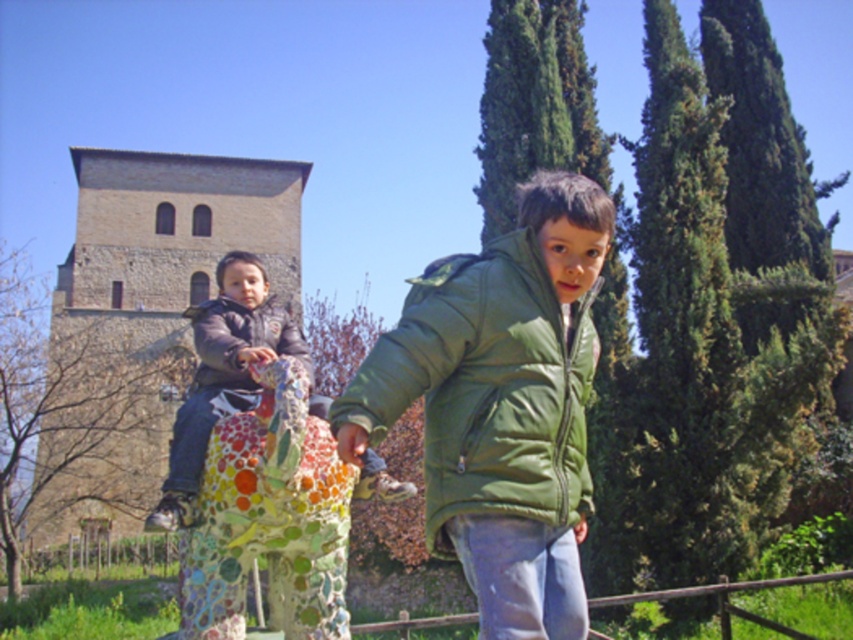
You are a photographer trying to capture both the green quilted jacket at center and the dark gray matte jacket at center in a single shot. Based on their positions, which jacket should you focus on first to ensure both are in frame?

The green quilted jacket at center is located below the dark gray matte jacket at center, so you should focus on the dark gray matte jacket at center first to ensure both are in frame.

You are a clothing store employee and need to determine which jacket is better suited for a customer who prefers a more voluminous style. Based on the image, which jacket between the matte black jacket at left and the dark gray matte jacket at center would you recommend?

The matte black jacket at left has a larger size compared to the dark gray matte jacket at center, so it would be the better choice for someone preferring a more voluminous style.

You are standing in the park scene and want to place a small flag exactly halfway between the two points, point (x=445, y=289) and point (x=228, y=307). Which direction should you move from the midpoint to ensure the flag is closer to the camera?

Since point (x=445, y=289) is closer to the camera than point (x=228, y=307), the midpoint between them would be closer to the point that is nearer. To place the flag exactly halfway, you should move towards the direction of point (x=445, y=289) from the midpoint to ensure it aligns with the closer point.